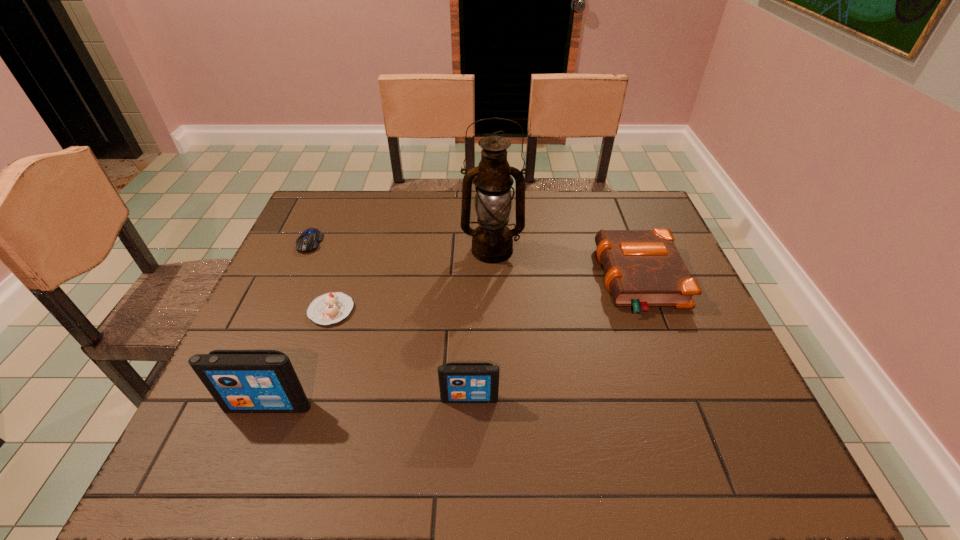
The width and height of the screenshot is (960, 540). I want to click on the left iPod, so click(x=241, y=381).

You are a GUI agent. You are given a task and a screenshot of the screen. Output one action in this format:
    pyautogui.click(x=<x>, y=<y>)
    Task: Click on the taller iPod
    
    Given the screenshot: What is the action you would take?
    pyautogui.click(x=241, y=381)

Find the location of a particular element. the right iPod is located at coordinates (459, 382).

Identify the location of the shorter iPod. The image size is (960, 540). point(459,382).

Where is `the tallest object`? the tallest object is located at coordinates (492, 241).

I want to click on the rightmost object, so click(643, 268).

You are a GUI agent. You are given a task and a screenshot of the screen. Output one action in this format:
    pyautogui.click(x=<x>, y=<y>)
    Task: Click on the Bible
    The image size is (960, 540).
    Given the screenshot: What is the action you would take?
    pyautogui.click(x=643, y=268)

You are a GUI agent. You are given a task and a screenshot of the screen. Output one action in this format:
    pyautogui.click(x=<x>, y=<y>)
    Task: Click on the shortest object
    
    Given the screenshot: What is the action you would take?
    pyautogui.click(x=308, y=241)

Locate an element on the screen. cupcake is located at coordinates (329, 308).

You are a GUI agent. You are given a task and a screenshot of the screen. Output one action in this format:
    pyautogui.click(x=<x>, y=<y>)
    Task: Click on the blank space located on the right of the oil lamp
    This screenshot has width=960, height=540.
    Given the screenshot: What is the action you would take?
    pyautogui.click(x=578, y=251)